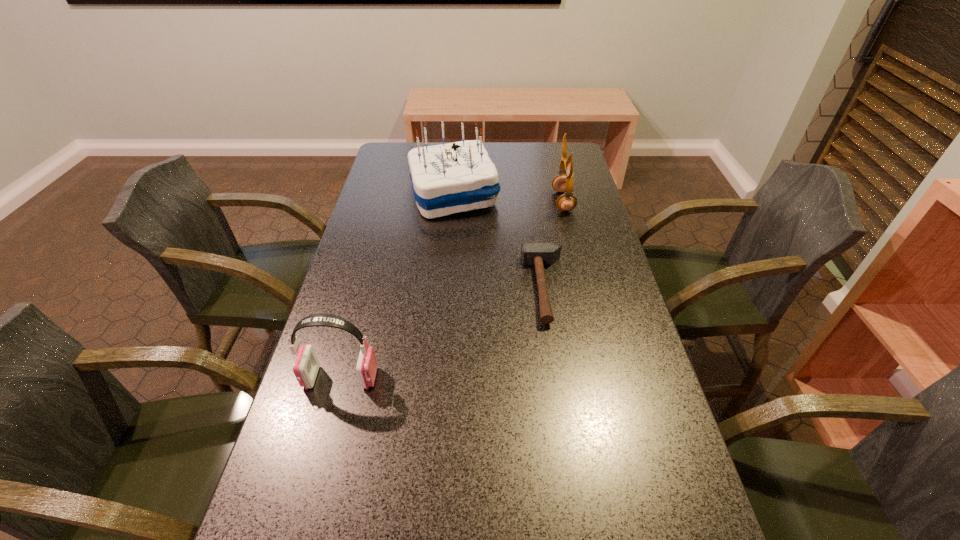
Where is `birthday cake`? birthday cake is located at coordinates (456, 177).

Locate an element on the screen. This screenshot has height=540, width=960. the right earphone is located at coordinates (562, 183).

Where is `the farther earphone`? This screenshot has width=960, height=540. the farther earphone is located at coordinates (562, 183).

The image size is (960, 540). I want to click on the nearest object, so click(x=306, y=365).

You are a GUI agent. You are given a task and a screenshot of the screen. Output one action in this format:
    pyautogui.click(x=<x>, y=<y>)
    Task: Click on the left earphone
    The image size is (960, 540).
    Given the screenshot: What is the action you would take?
    pyautogui.click(x=306, y=365)

Identify the location of the third object from left to right. The width and height of the screenshot is (960, 540). (539, 254).

Where is `hammer`? hammer is located at coordinates coord(539,254).

Where is `blank space located 0.240m on the front of the birthday cake`? The width and height of the screenshot is (960, 540). blank space located 0.240m on the front of the birthday cake is located at coordinates (446, 273).

Locate an element on the screen. vacant space located 0.220m on the front-facing side of the farther earphone is located at coordinates (487, 201).

You are a GUI agent. You are given a task and a screenshot of the screen. Output one action in this format:
    pyautogui.click(x=<x>, y=<y>)
    Task: Click on the vacant space located 0.050m on the front-facing side of the farther earphone
    This screenshot has height=540, width=960.
    Given the screenshot: What is the action you would take?
    pyautogui.click(x=538, y=201)